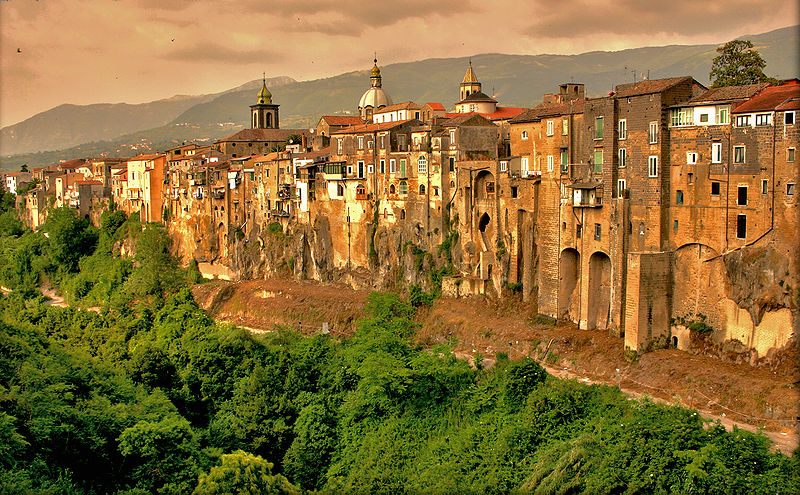
Find the location of a particular element. The image size is (800, 495). arched entryway is located at coordinates (605, 275), (570, 276).